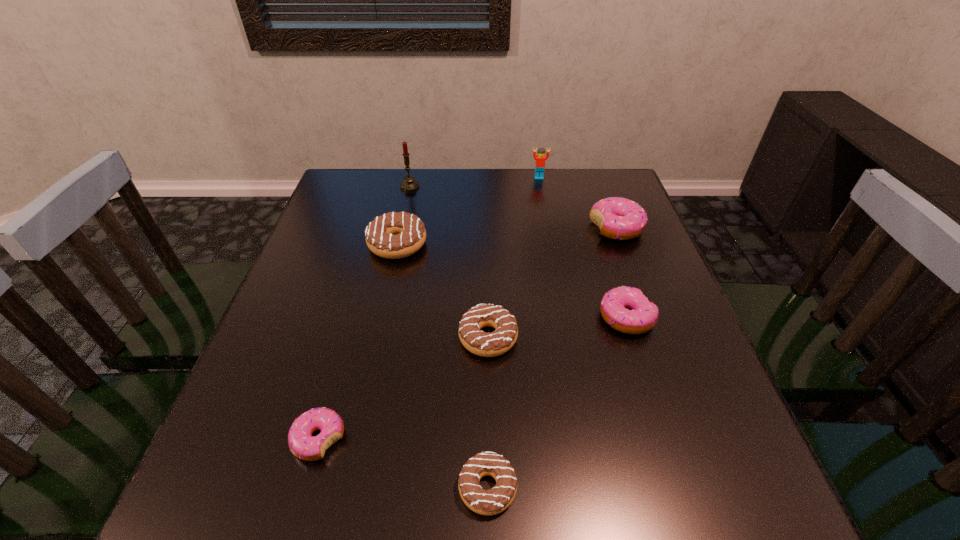
You are a GUI agent. You are given a task and a screenshot of the screen. Output one action in this format:
    pyautogui.click(x=<x>, y=<y>)
    Task: Click on the nearest pink doughnut
    
    Given the screenshot: What is the action you would take?
    pyautogui.click(x=302, y=444)

Find the location of a particular element. This screenshot has width=960, height=540. the nearest chocolate doughnut is located at coordinates (493, 501).

Image resolution: width=960 pixels, height=540 pixels. Find the location of `free spot located on the left of the seventh nearest object`. free spot located on the left of the seventh nearest object is located at coordinates (367, 187).

Identify the location of vacant position located on the face of the seventh shortest object. (551, 240).

Where is `free point located 0.170m on the left of the farthest pink doughnut`? free point located 0.170m on the left of the farthest pink doughnut is located at coordinates (524, 228).

Find the location of `blank area located on the front of the farthest chocolate doughnut`. blank area located on the front of the farthest chocolate doughnut is located at coordinates (372, 362).

This screenshot has height=540, width=960. I want to click on vacant space located on the left of the second nearest pink doughnut, so click(458, 318).

In order to click on free region located on the right of the second farthest chocolate doughnut in this screenshot , I will do `click(679, 338)`.

In order to click on blank area located on the right of the smallest pink doughnut in this screenshot , I will do `click(572, 439)`.

Where is `vacant space located 0.110m on the right of the nearest chocolate doughnut`? vacant space located 0.110m on the right of the nearest chocolate doughnut is located at coordinates (588, 488).